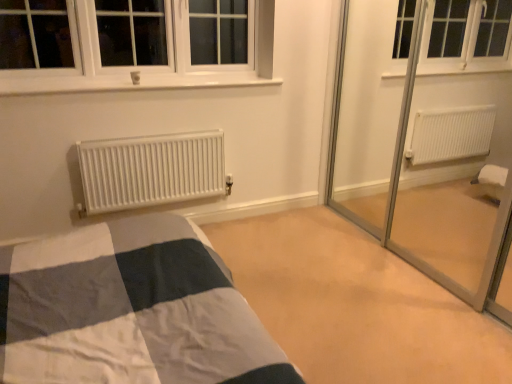
Question: Is white matte radiator at center behind beige carpet at center?

Choices:
 (A) no
 (B) yes

Answer: (B)

Question: Is white matte radiator at center facing towards beige carpet at center?

Choices:
 (A) no
 (B) yes

Answer: (A)

Question: Considering the relative positions of white matte radiator at center and beige carpet at center in the image provided, is white matte radiator at center to the left of beige carpet at center from the viewer's perspective?

Choices:
 (A) no
 (B) yes

Answer: (B)

Question: Are white matte radiator at center and beige carpet at center making contact?

Choices:
 (A) yes
 (B) no

Answer: (B)

Question: Can you confirm if white matte radiator at center is smaller than beige carpet at center?

Choices:
 (A) yes
 (B) no

Answer: (A)

Question: Is white matte radiator at center wider than beige carpet at center?

Choices:
 (A) yes
 (B) no

Answer: (B)

Question: Considering the relative sizes of beige carpet at center and white matte radiator at center in the image provided, is beige carpet at center smaller than white matte radiator at center?

Choices:
 (A) yes
 (B) no

Answer: (B)

Question: Is beige carpet at center behind white matte radiator at center?

Choices:
 (A) no
 (B) yes

Answer: (A)

Question: Is beige carpet at center shorter than white matte radiator at center?

Choices:
 (A) no
 (B) yes

Answer: (B)

Question: From a real-world perspective, is beige carpet at center on white matte radiator at center?

Choices:
 (A) yes
 (B) no

Answer: (B)

Question: Would you say beige carpet at center is outside white matte radiator at center?

Choices:
 (A) no
 (B) yes

Answer: (B)

Question: Considering the relative positions of beige carpet at center and white matte radiator at center in the image provided, is beige carpet at center to the left of white matte radiator at center from the viewer's perspective?

Choices:
 (A) no
 (B) yes

Answer: (A)

Question: In the image, is white matte radiator at center on the left side or the right side of beige carpet at center?

Choices:
 (A) right
 (B) left

Answer: (B)